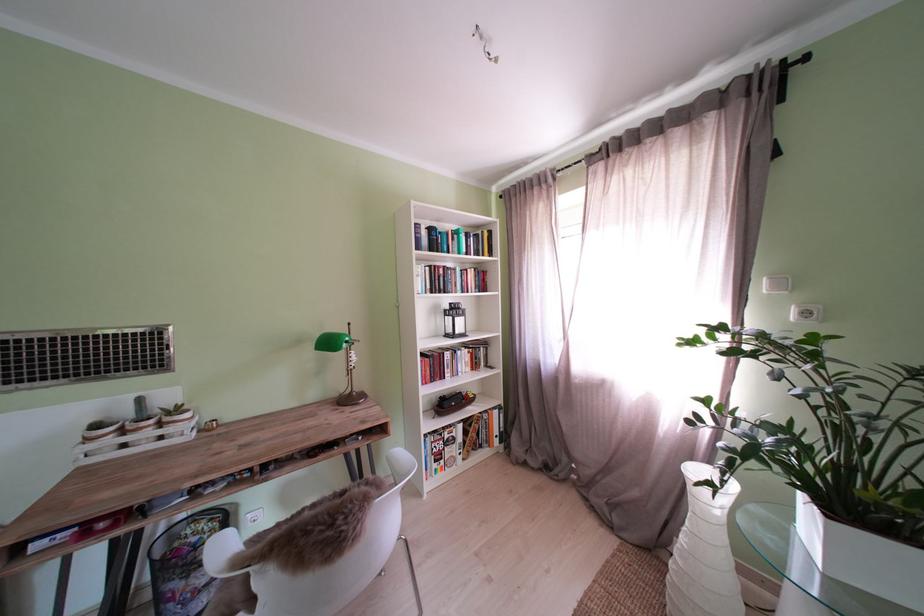
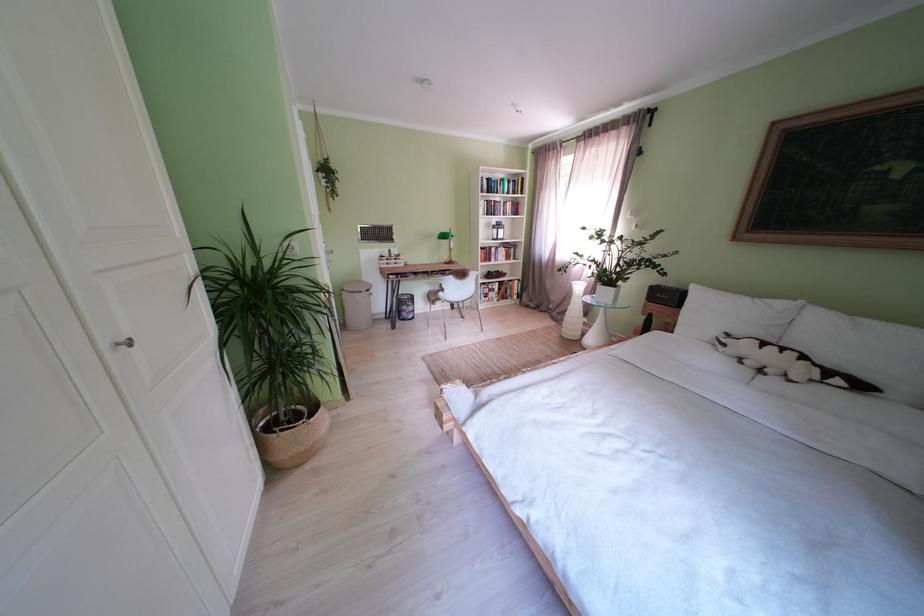
Question: The images are taken continuously from a first-person perspective. In which direction are you moving?

Choices:
 (A) Left
 (B) Right
 (C) Forward
 (D) Backward

Answer: (D)